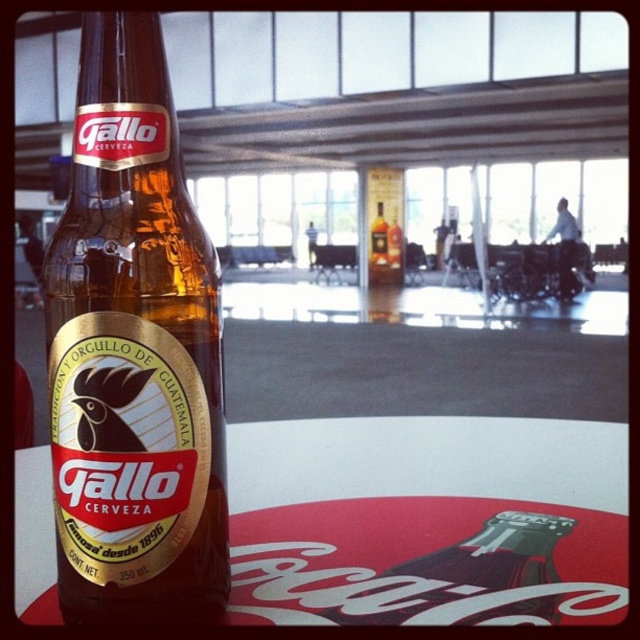
Question: Considering the relative positions of white glossy table at center and black glossy cock at center in the image provided, where is white glossy table at center located with respect to black glossy cock at center?

Choices:
 (A) above
 (B) below

Answer: (B)

Question: Which object is closer to the camera taking this photo?

Choices:
 (A) matte glass bottle at center
 (B) glass coca-cola bottle at center
 (C) black glossy cock at center

Answer: (C)

Question: Which object is closer to the camera taking this photo?

Choices:
 (A) glass coca-cola bottle at center
 (B) white glossy table at center
 (C) brown glass bottle at center

Answer: (C)

Question: Does glass coca-cola bottle at center lie behind matte glass bottle at center?

Choices:
 (A) no
 (B) yes

Answer: (A)

Question: Is brown glass bottle at center thinner than black glossy cock at center?

Choices:
 (A) no
 (B) yes

Answer: (A)

Question: Which point is farther to the camera?

Choices:
 (A) black glossy cock at center
 (B) matte glass bottle at center
 (C) brown glass bottle at center
 (D) glass coca-cola bottle at center

Answer: (B)